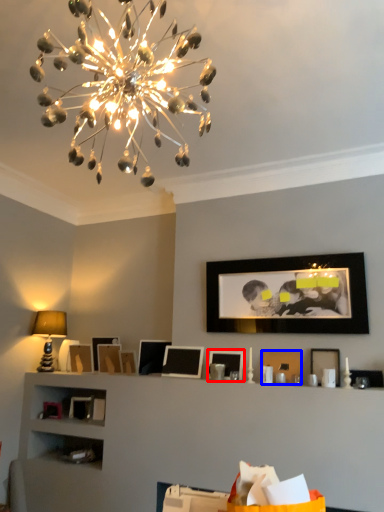
Question: Which object appears farthest to the camera in this image, picture frame (highlighted by a red box) or picture frame (highlighted by a blue box)?

Choices:
 (A) picture frame
 (B) picture frame

Answer: (A)